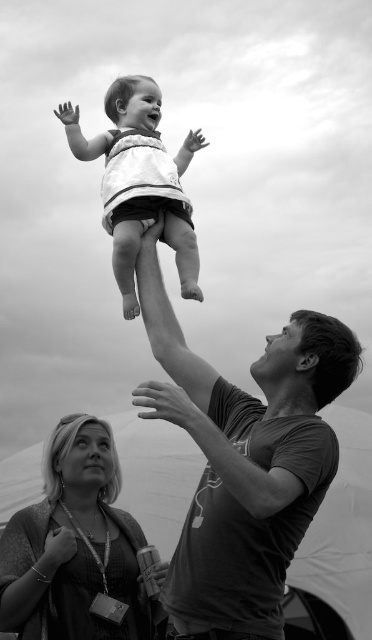
You are standing at the location of the smooth dark gray shirt at upper center and want to hand a small gift to the person wearing the matte black dress at lower left. Can you reach them without moving from your current position? Please explain your reasoning.

The smooth dark gray shirt at upper center and matte black dress at lower left are 7.44 meters apart. Since the distance is too far to reach without moving, you cannot hand the gift directly from your current position.

What is the exact location of the matte black dress at lower left in the image?

The matte black dress at lower left is located at point coordinates (x=75, y=547).

Based on the scene, if you were to draw a vertical line from the top of the smooth dark gray shirt at upper center to the bottom of the white fabric baby at center, would the line pass through the baby?

The smooth dark gray shirt at upper center is taller than the white fabric baby at center. Therefore, a vertical line drawn from the top of the smooth dark gray shirt at upper center to its bottom would extend below the baby, passing through the white fabric baby at center.